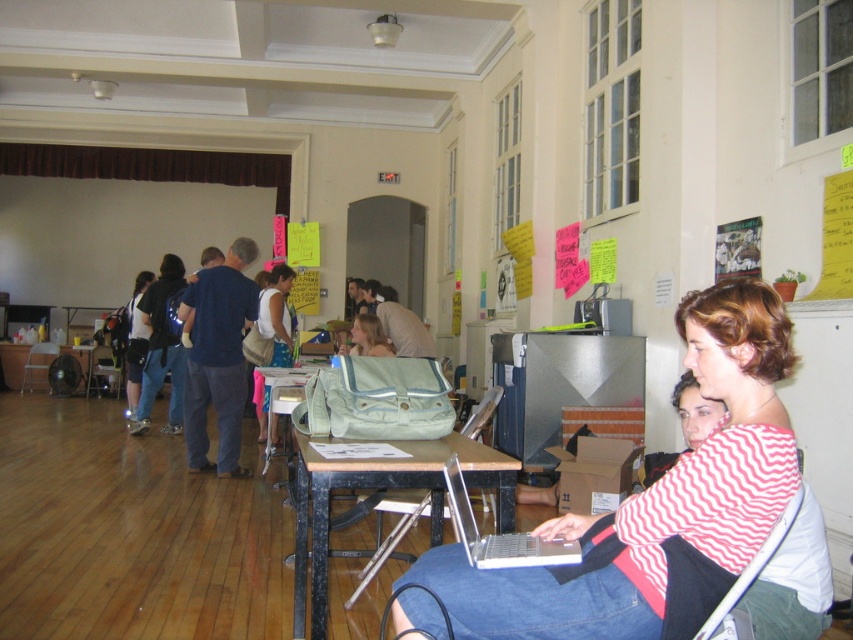
You are standing in the community center and see the white fabric bag at center. If you want to place a small item into the bag, where should you position your hand relative to the bag?

The white fabric bag at center is located at point (x=276, y=316), so you should position your hand near that coordinate to place the item into the bag.

You are a person who is 1.69 meters tall. You are standing in the scene and want to reach the clear plastic laptop at lower center. Can you comfortably reach it without standing on something?

The clear plastic laptop at lower center is 1.69 meters away from you. Since your height is 1.69 meters, you can comfortably reach it without needing to stand on anything.

You are organizing a workshop and need to place the clear plastic laptop at lower center and the matte blue backpack at center on a shelf. The shelf has limited space, and you want to ensure they fit side by side. Which object should be placed first to maximize space efficiency?

The clear plastic laptop at lower center has a lesser width compared to the matte blue backpack at center, so placing the backpack first will leave enough space for the laptop next to it.